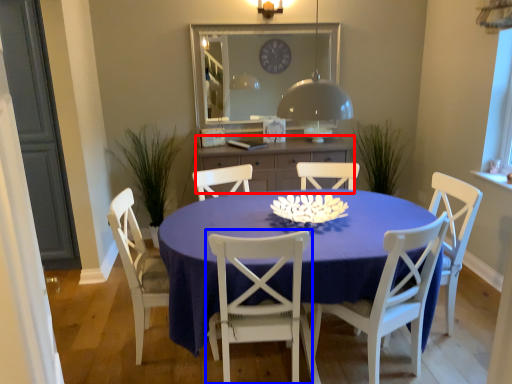
Question: Which point is further to the camera, cabinetry (highlighted by a red box) or chair (highlighted by a blue box)?

Choices:
 (A) cabinetry
 (B) chair

Answer: (A)